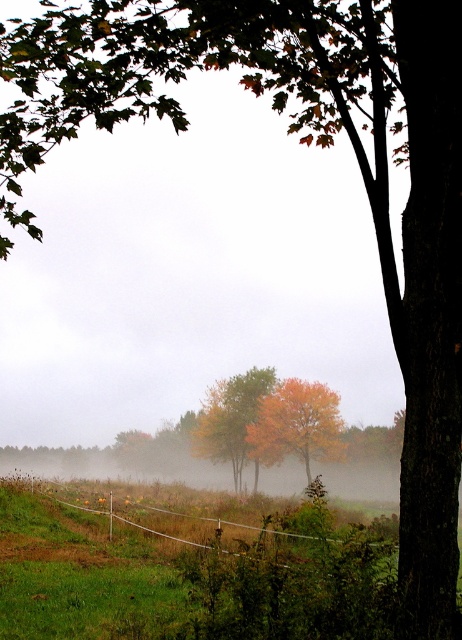
This screenshot has width=462, height=640. What do you see at coordinates (176, 528) in the screenshot?
I see `green wire fence at lower center` at bounding box center [176, 528].

Find the location of a particular element. green wire fence at lower center is located at coordinates (176, 528).

Can you confirm if green wire fence at lower center is positioned below autumn leaves at center?

No, green wire fence at lower center is not below autumn leaves at center.

Looking at this image, can you confirm if green wire fence at lower center is positioned to the left of autumn leaves at center?

Incorrect, green wire fence at lower center is not on the left side of autumn leaves at center.

The image size is (462, 640). Identify the location of green wire fence at lower center. (176, 528).

Who is taller, orange matte tree at center or autumn leaves at center?

With more height is orange matte tree at center.

You are a GUI agent. You are given a task and a screenshot of the screen. Output one action in this format:
    pyautogui.click(x=<x>, y=<y>)
    Task: Click on the orange matte tree at center
    The width and height of the screenshot is (462, 640).
    Given the screenshot: What is the action you would take?
    coord(297,424)